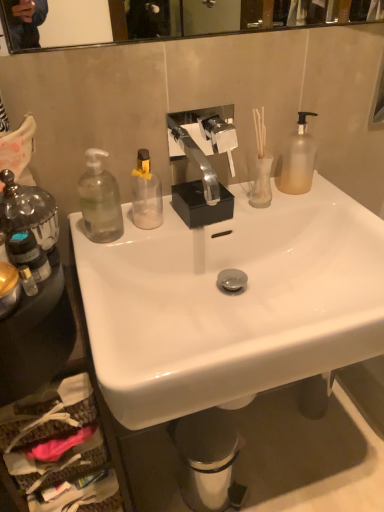
Question: From the image's perspective, is transparent glass soap dispenser at left, which is the 2th bottle from right to left, below translucent glass bottle at left, placed as the 3th bottle when sorted from right to left?

Choices:
 (A) no
 (B) yes

Answer: (A)

Question: Would you say transparent glass soap dispenser at left, acting as the fourth bottle starting from the left, is outside translucent glass bottle at left, the third bottle when ordered from left to right?

Choices:
 (A) yes
 (B) no

Answer: (A)

Question: Is transparent glass soap dispenser at left, acting as the fourth bottle starting from the left, not close to translucent glass bottle at left, placed as the 3th bottle when sorted from right to left?

Choices:
 (A) no
 (B) yes

Answer: (A)

Question: Is transparent glass soap dispenser at left, which is the 2th bottle from right to left, aimed at translucent glass bottle at left, placed as the 3th bottle when sorted from right to left?

Choices:
 (A) no
 (B) yes

Answer: (A)

Question: Are transparent glass soap dispenser at left, which is the 2th bottle from right to left, and translucent glass bottle at left, placed as the 3th bottle when sorted from right to left, making contact?

Choices:
 (A) no
 (B) yes

Answer: (A)

Question: From a real-world perspective, is transparent glass soap dispenser at left, which is the 2th bottle from right to left, under translucent glass bottle at left, placed as the 3th bottle when sorted from right to left?

Choices:
 (A) yes
 (B) no

Answer: (A)

Question: Considering the relative sizes of white glossy sink at center and clear glass bottle at left, which is counted as the fifth bottle, starting from the right, in the image provided, is white glossy sink at center smaller than clear glass bottle at left, which is counted as the fifth bottle, starting from the right,?

Choices:
 (A) no
 (B) yes

Answer: (A)

Question: Considering the relative sizes of white glossy sink at center and clear glass bottle at left, which is counted as the fifth bottle, starting from the right, in the image provided, is white glossy sink at center thinner than clear glass bottle at left, which is counted as the fifth bottle, starting from the right,?

Choices:
 (A) no
 (B) yes

Answer: (A)

Question: From the image's perspective, is white glossy sink at center located above clear glass bottle at left, the 1th bottle when ordered from left to right?

Choices:
 (A) yes
 (B) no

Answer: (B)

Question: Is white glossy sink at center wider than clear glass bottle at left, the 1th bottle when ordered from left to right?

Choices:
 (A) yes
 (B) no

Answer: (A)

Question: Does white glossy sink at center come in front of clear glass bottle at left, the 1th bottle when ordered from left to right?

Choices:
 (A) no
 (B) yes

Answer: (B)

Question: Could you tell me if white glossy sink at center is turned towards clear glass bottle at left, the 1th bottle when ordered from left to right?

Choices:
 (A) yes
 (B) no

Answer: (B)

Question: From the image's perspective, is translucent plastic bottle at left, which ranks as the 2th bottle in left-to-right order, above clear glass bottle at left, the 1th bottle when ordered from left to right?

Choices:
 (A) no
 (B) yes

Answer: (A)